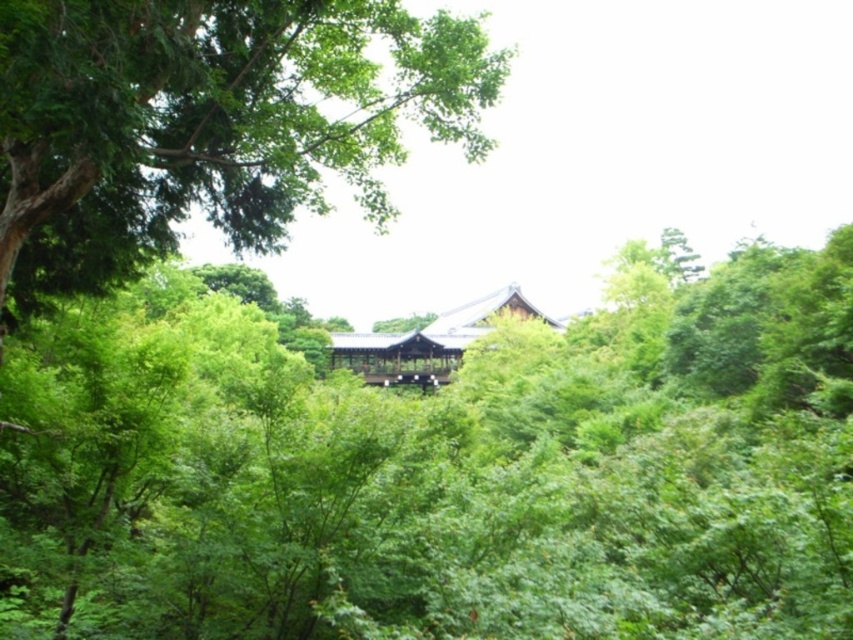
You are a hiker who wants to take a photo of the shiny dark brown wooden hut at center from the green leafy forest at center. Will the forest block your view of the hut?

The green leafy forest at center is shorter than the shiny dark brown wooden hut at center, so the forest will not block your view of the hut.

You are standing in the middle of the green leafy forest at center and want to reach the shiny dark brown wooden hut at center. Which direction should you move to get there?

You should move to the left because the green leafy forest at center is to the right of the shiny dark brown wooden hut at center, so moving left would take you towards the hut.